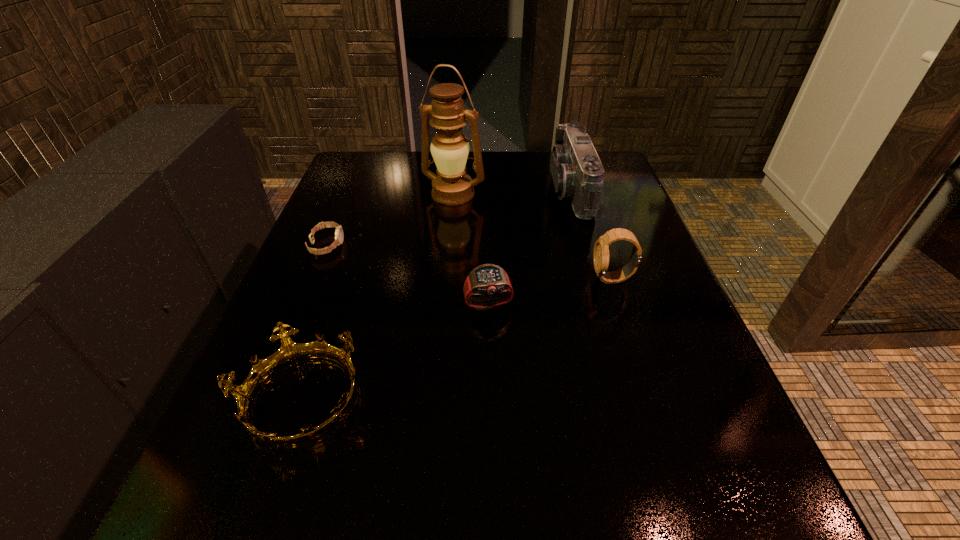
Find the location of a particular element. Image resolution: width=960 pixels, height=540 pixels. unoccupied position between the third nearest object and the camcorder is located at coordinates (591, 234).

What are the coordinates of `free space between the nearest object and the third nearest object` in the screenshot? It's located at (456, 339).

Identify which object is the second nearest to the nearest watch. Please provide its 2D coordinates. Your answer should be formatted as a tuple, i.e. [(x, y)], where the tuple contains the x and y coordinates of a point satisfying the conditions above.

[(289, 352)]

What are the coordinates of `object that is the closest to the crown` in the screenshot? It's located at (485, 279).

Locate which watch ranks in proximity to the crown. Please provide its 2D coordinates. Your answer should be formatted as a tuple, i.e. [(x, y)], where the tuple contains the x and y coordinates of a point satisfying the conditions above.

[(485, 279)]

Identify the location of the third closest watch to the second tallest object. (339, 236).

Image resolution: width=960 pixels, height=540 pixels. In order to click on free space in the image that satisfies the following two spatial constraints: 1. on the face of the third farthest object; 2. on the right side of the second shortest watch in this screenshot , I will do `click(301, 305)`.

In order to click on vacant space that satisfies the following two spatial constraints: 1. on the face of the leftmost watch; 2. on the left side of the crown in this screenshot , I will do `click(262, 399)`.

Identify the location of vacant region that satisfies the following two spatial constraints: 1. on the face of the shortest watch; 2. on the right side of the crown. (262, 399).